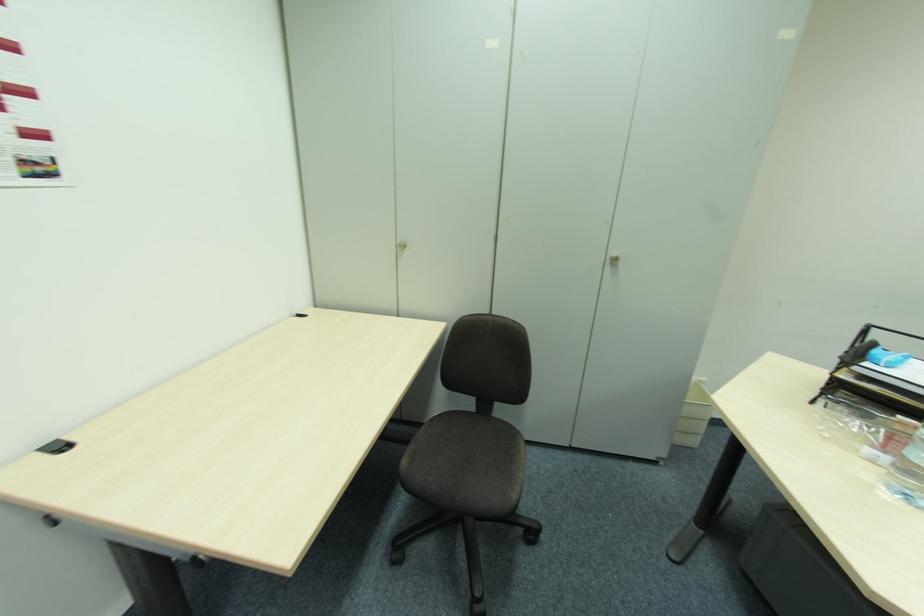
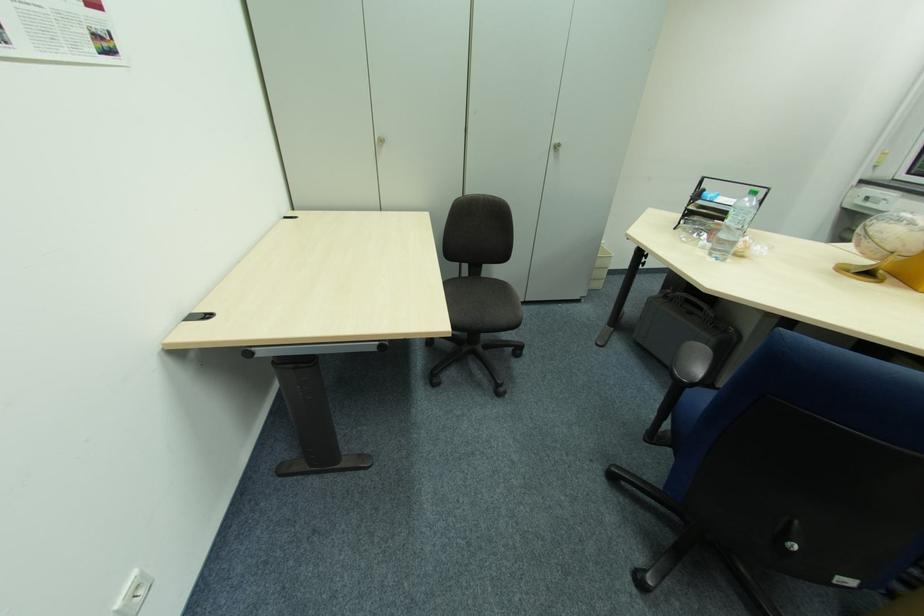
In the second image, find the point that corresponds to [495,418] in the first image.

(485, 278)